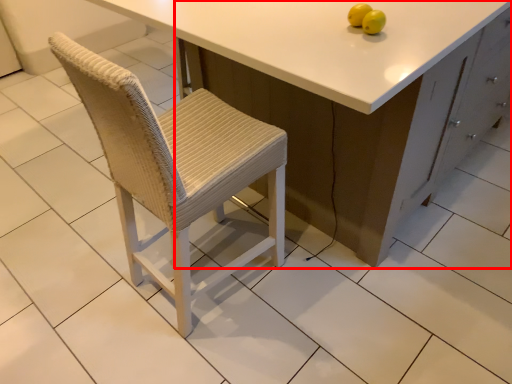
Question: From the image's perspective, what is the correct spatial relationship of cabinetry (annotated by the red box) in relation to fruit?

Choices:
 (A) below
 (B) above

Answer: (B)